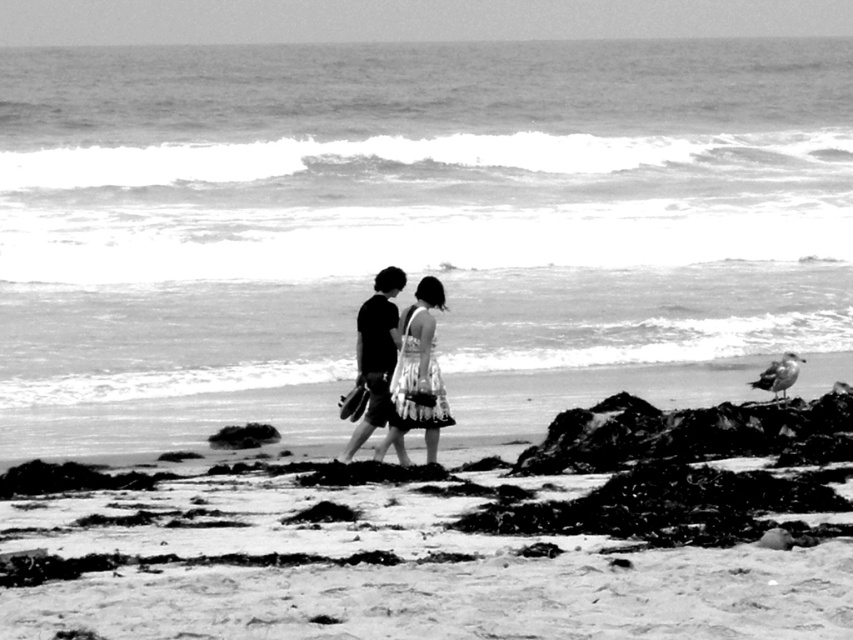
Can you confirm if smooth ocean water at center is taller than smooth sand at center?

Yes.

Can you confirm if smooth ocean water at center is positioned to the right of smooth sand at center?

Incorrect, smooth ocean water at center is not on the right side of smooth sand at center.

Between point (683, 250) and point (90, 579), which one is positioned in front?

Positioned in front is point (90, 579).

The image size is (853, 640). Identify the location of smooth ocean water at center. (407, 225).

Consider the image. Does smooth ocean water at center have a greater width compared to dark gray fabric shorts at center?

Indeed, smooth ocean water at center has a greater width compared to dark gray fabric shorts at center.

Is smooth ocean water at center shorter than dark gray fabric shorts at center?

In fact, smooth ocean water at center may be taller than dark gray fabric shorts at center.

Does point (253, 403) lie behind point (399, 460)?

Yes, it is behind point (399, 460).

Identify the location of smooth ocean water at center. The image size is (853, 640). (407, 225).

Is smooth sand at center taller than floral dress at center?

In fact, smooth sand at center may be shorter than floral dress at center.

Where is `smooth sand at center`? Image resolution: width=853 pixels, height=640 pixels. smooth sand at center is located at coordinates (380, 545).

I want to click on smooth sand at center, so click(x=380, y=545).